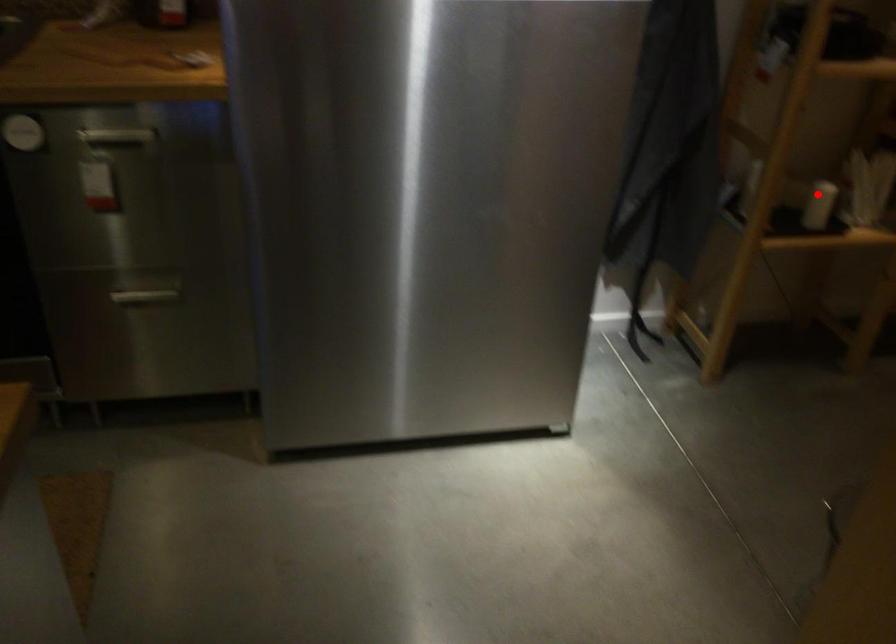
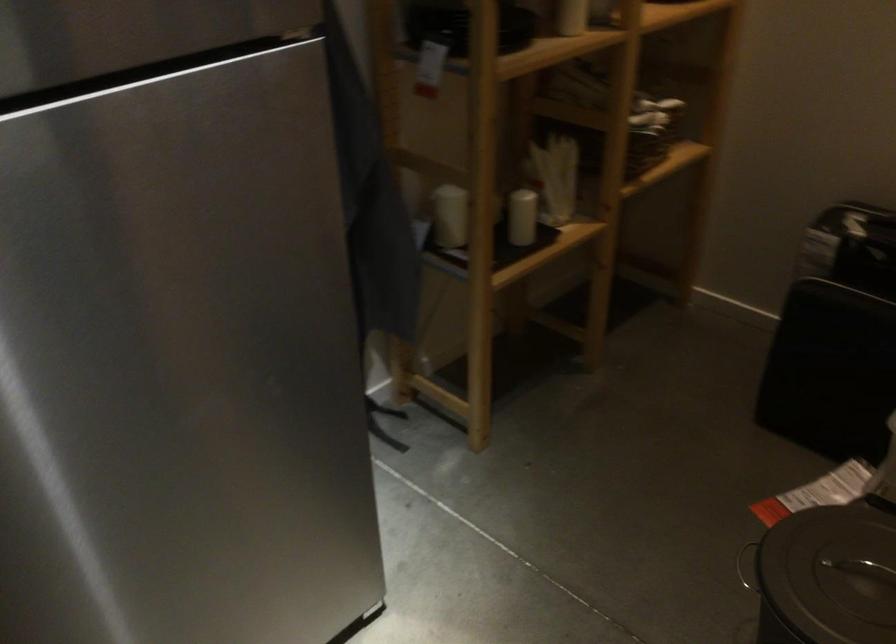
Where in the second image is the point corresponding to the highlighted location from the first image?

(521, 216)